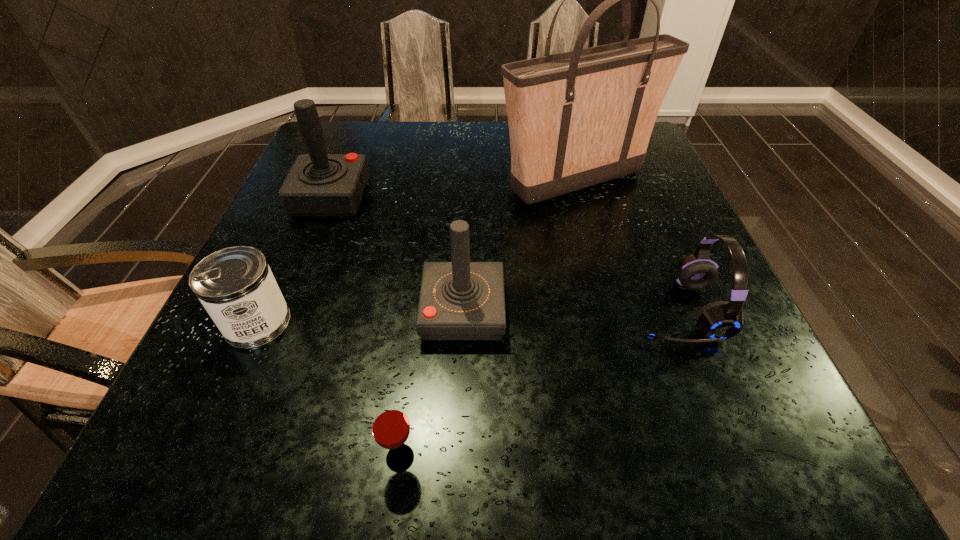
Identify the location of unoccupied area between the farther joystick and the third shortest object. This screenshot has width=960, height=540. (503, 254).

This screenshot has width=960, height=540. I want to click on vacant region between the shopping bag and the headset, so click(x=627, y=246).

Where is `free space between the shorter joystick and the nearest object`? free space between the shorter joystick and the nearest object is located at coordinates (432, 384).

You are a GUI agent. You are given a task and a screenshot of the screen. Output one action in this format:
    pyautogui.click(x=<x>, y=<y>)
    Task: Click on the free area in between the farther joystick and the can
    Image resolution: width=960 pixels, height=540 pixels.
    Given the screenshot: What is the action you would take?
    pyautogui.click(x=294, y=260)

This screenshot has height=540, width=960. Find the location of `the fourth closest object relative to the shopping bag`. the fourth closest object relative to the shopping bag is located at coordinates (235, 285).

Locate which object is the fifth closest to the nearest object. Please provide its 2D coordinates. Your answer should be formatted as a tuple, i.e. [(x, y)], where the tuple contains the x and y coordinates of a point satisfying the conditions above.

[(576, 119)]

The height and width of the screenshot is (540, 960). I want to click on blank area in the image that satisfies the following two spatial constraints: 1. on the base of the glass; 2. on the left side of the left joystick, so click(228, 458).